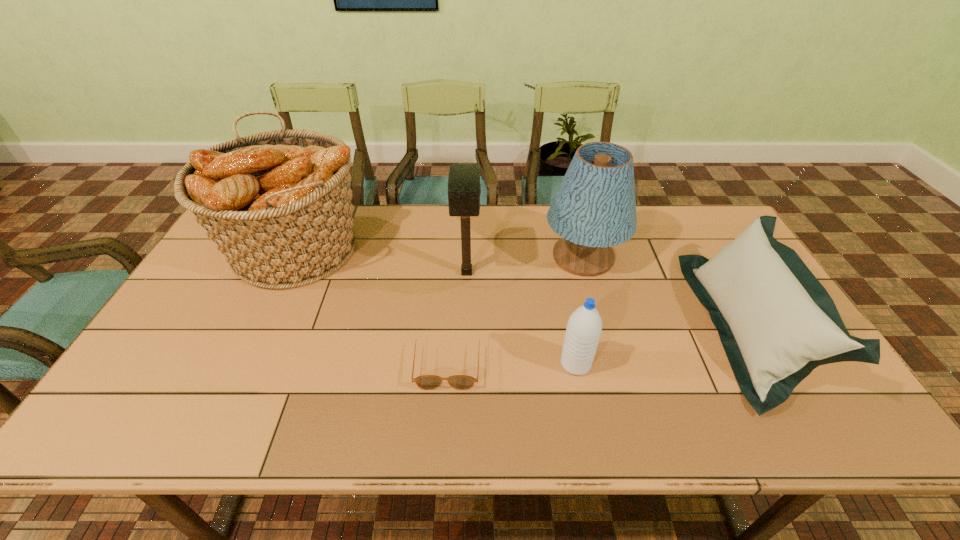
Where is `the leftmost object`? The height and width of the screenshot is (540, 960). the leftmost object is located at coordinates (277, 204).

The height and width of the screenshot is (540, 960). In order to click on lampshade in this screenshot , I will do `click(594, 208)`.

You are a GUI agent. You are given a task and a screenshot of the screen. Output one action in this format:
    pyautogui.click(x=<x>, y=<y>)
    Task: Click on the mallet
    This screenshot has height=540, width=960.
    Given the screenshot: What is the action you would take?
    464,189

This screenshot has height=540, width=960. I want to click on water bottle, so pos(584,326).

Locate an element on the screen. Image resolution: width=960 pixels, height=540 pixels. cushion is located at coordinates (777, 323).

The width and height of the screenshot is (960, 540). What are the coordinates of `sunglasses` in the screenshot? It's located at (426, 382).

At what (x,y) coordinates should I click in order to perform the action: click on vacant space positioned 0.340m on the front of the leftmost object. Please return your answer as a coordinate pair (x, y). This screenshot has height=540, width=960. Looking at the image, I should click on (218, 411).

What are the coordinates of `vacant space located on the right of the lampshade` in the screenshot? It's located at (640, 257).

Find the location of a particular element. This screenshot has width=960, height=540. vacant point located on the left of the mallet is located at coordinates (357, 272).

Locate an element on the screen. The width and height of the screenshot is (960, 540). blank space located 0.400m on the back of the water bottle is located at coordinates (554, 251).